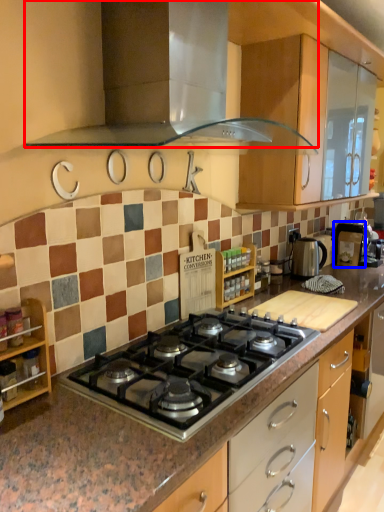
Question: Which point is further to the camera, home appliance (highlighted by a red box) or appliance (highlighted by a blue box)?

Choices:
 (A) home appliance
 (B) appliance

Answer: (B)